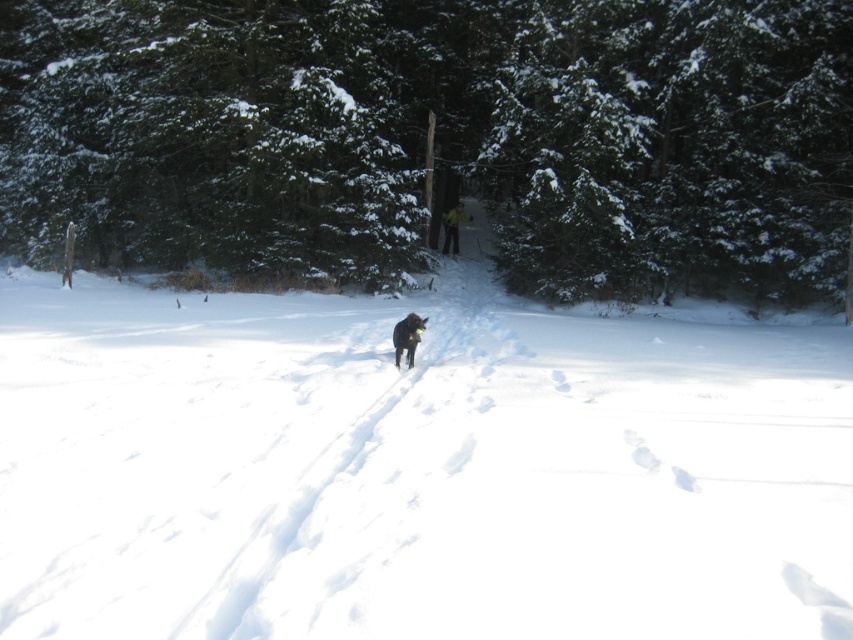
Question: Does white fluffy snow at center have a larger size compared to snow-covered evergreen tree at center?

Choices:
 (A) yes
 (B) no

Answer: (B)

Question: Is white fluffy snow at center further to the viewer compared to snow-covered evergreen tree at center?

Choices:
 (A) yes
 (B) no

Answer: (B)

Question: Which point appears farthest from the camera in this image?

Choices:
 (A) [x=408, y=330]
 (B) [x=465, y=220]
 (C) [x=438, y=128]
 (D) [x=598, y=618]

Answer: (B)

Question: Does white fluffy snow at center appear over yellow fabric skier at center?

Choices:
 (A) no
 (B) yes

Answer: (A)

Question: Which of the following is the closest to the observer?

Choices:
 (A) yellow fabric skier at center
 (B) snow-covered evergreen tree at center

Answer: (B)

Question: Which point is farther to the camera?

Choices:
 (A) (x=91, y=372)
 (B) (x=68, y=189)
 (C) (x=409, y=353)
 (D) (x=450, y=241)

Answer: (D)